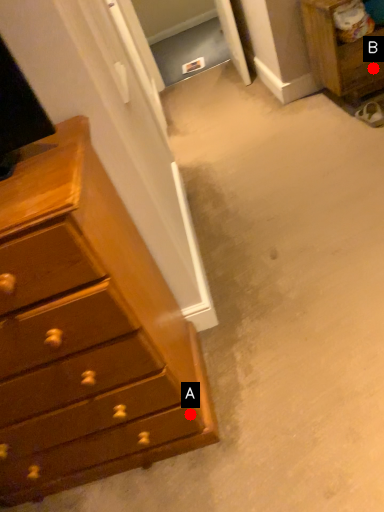
Question: Two points are circled on the image, labeled by A and B beside each circle. Which point is closer to the camera taking this photo?

Choices:
 (A) A is closer
 (B) B is closer

Answer: (A)